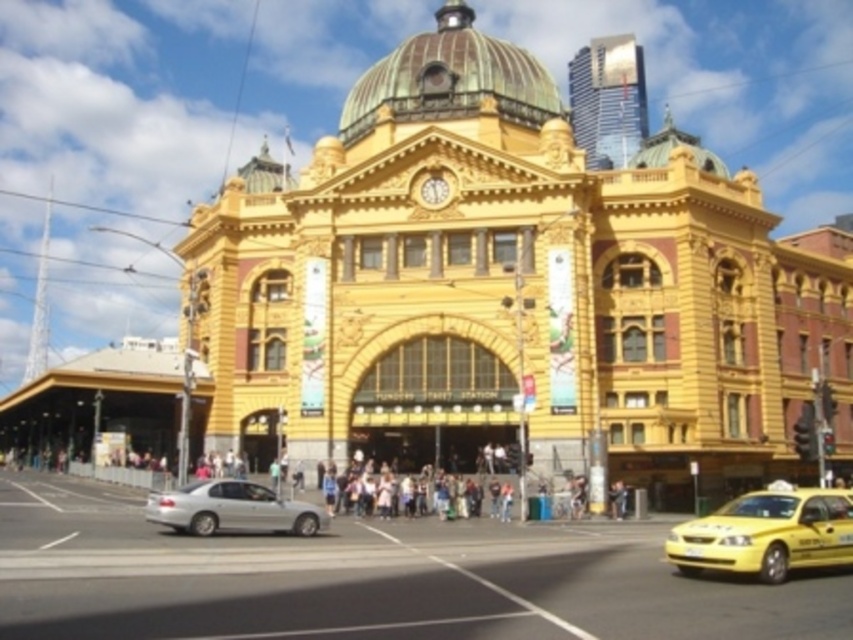
Question: Is yellow metallic taxi at center to the left of satin silver sedan at lower left from the viewer's perspective?

Choices:
 (A) no
 (B) yes

Answer: (A)

Question: Which point is closer to the camera?

Choices:
 (A) (289, 630)
 (B) (672, 536)
 (C) (201, 522)

Answer: (A)

Question: Which is nearer to the yellow metallic taxi at center?

Choices:
 (A) satin silver sedan at lower left
 (B) yellow matte taxi at lower right

Answer: (A)

Question: Which of the following is the closest to the observer?

Choices:
 (A) yellow matte taxi at lower right
 (B) yellow metallic taxi at center

Answer: (B)

Question: Is yellow metallic taxi at center smaller than satin silver sedan at lower left?

Choices:
 (A) yes
 (B) no

Answer: (B)

Question: Is yellow metallic taxi at center further to camera compared to satin silver sedan at lower left?

Choices:
 (A) no
 (B) yes

Answer: (A)